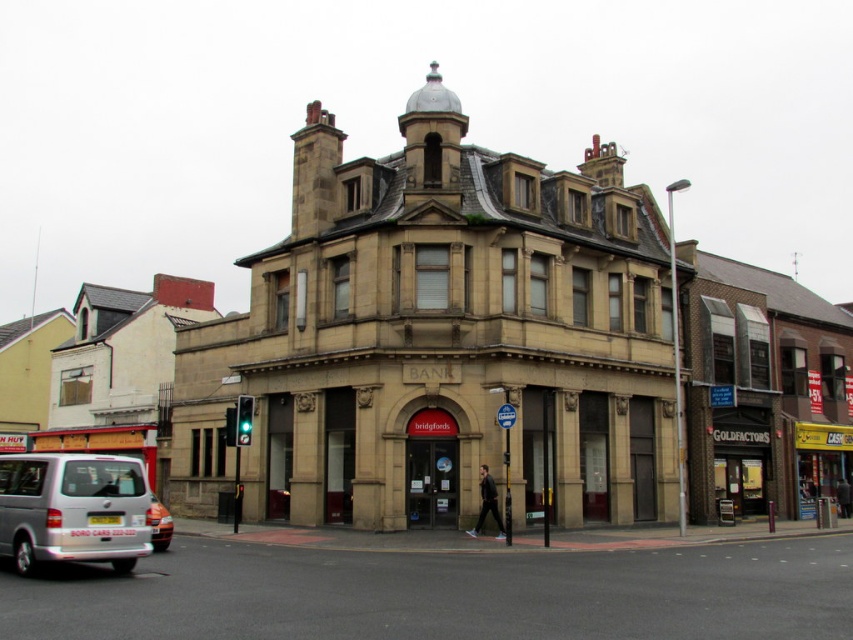
Question: Which of the following is the closest to the observer?

Choices:
 (A) metallic silver van at lower left
 (B) orange matte car at lower left

Answer: (A)

Question: Can you confirm if metallic silver van at lower left is bigger than orange matte car at lower left?

Choices:
 (A) yes
 (B) no

Answer: (A)

Question: Does metallic silver van at lower left appear under orange matte car at lower left?

Choices:
 (A) no
 (B) yes

Answer: (A)

Question: Which point is closer to the camera?

Choices:
 (A) (80, 458)
 (B) (164, 515)
 (C) (611, 554)

Answer: (A)

Question: Is metallic silver van at lower left to the right of silver metallic van at lower left from the viewer's perspective?

Choices:
 (A) no
 (B) yes

Answer: (B)

Question: Among these objects, which one is nearest to the camera?

Choices:
 (A) metallic silver van at lower left
 (B) silver metallic van at lower left
 (C) orange matte car at lower left

Answer: (A)